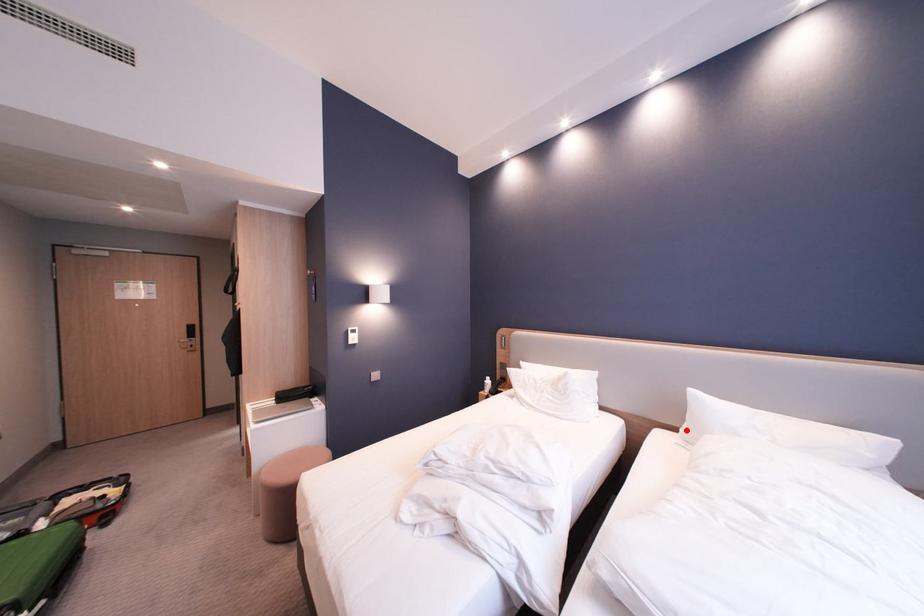
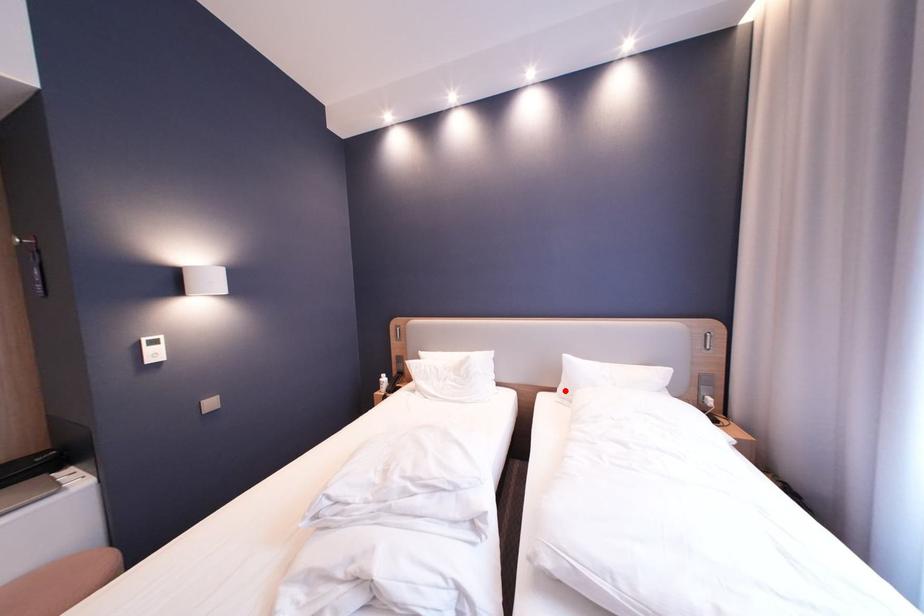
I am providing you with two images of the same scene from different viewpoints. A red point is marked on the first image and another point is marked on the second image. Is the red point in image1 aligned with the point shown in image2?

Yes